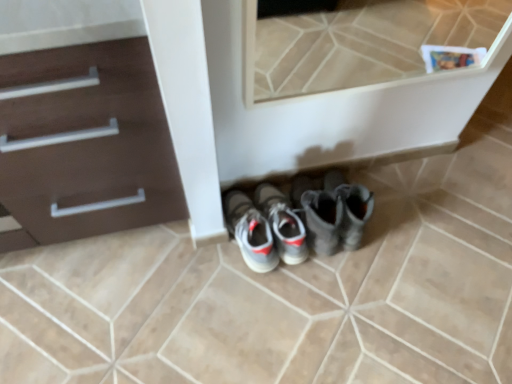
Find the location of a particular element. Image resolution: width=512 pixels, height=384 pixels. vacant space in front of gray fabric sneakers at center is located at coordinates pos(260,307).